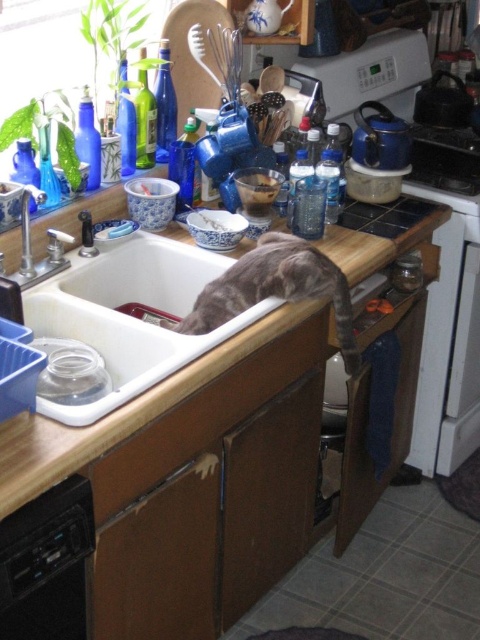
Who is shorter, wooden at upper center or black plastic dishwasher at lower left?

black plastic dishwasher at lower left

The image size is (480, 640). I want to click on wooden at upper center, so click(120, 413).

Measure the distance between point (61, 428) and camera.

Point (61, 428) and camera are 1.13 meters apart.

Identify the location of wooden at upper center. This screenshot has height=640, width=480. (120, 413).

Can you confirm if wooden at upper center is thinner than gray fur cat at sink?

No.

Does wooden at upper center have a greater width compared to gray fur cat at sink?

Yes.

Find the location of a particular element. The height and width of the screenshot is (640, 480). wooden at upper center is located at coordinates [x=120, y=413].

Who is positioned more to the left, gray fur cat at sink or brushed metal faucet at sink left?

brushed metal faucet at sink left

Is gray fur cat at sink to the left of brushed metal faucet at sink left from the viewer's perspective?

Incorrect, gray fur cat at sink is not on the left side of brushed metal faucet at sink left.

Is point (264, 259) closer to camera compared to point (24, 256)?

No, it is behind (24, 256).

Find the location of a particular element. Image resolution: width=480 pixels, height=640 pixels. gray fur cat at sink is located at coordinates (276, 289).